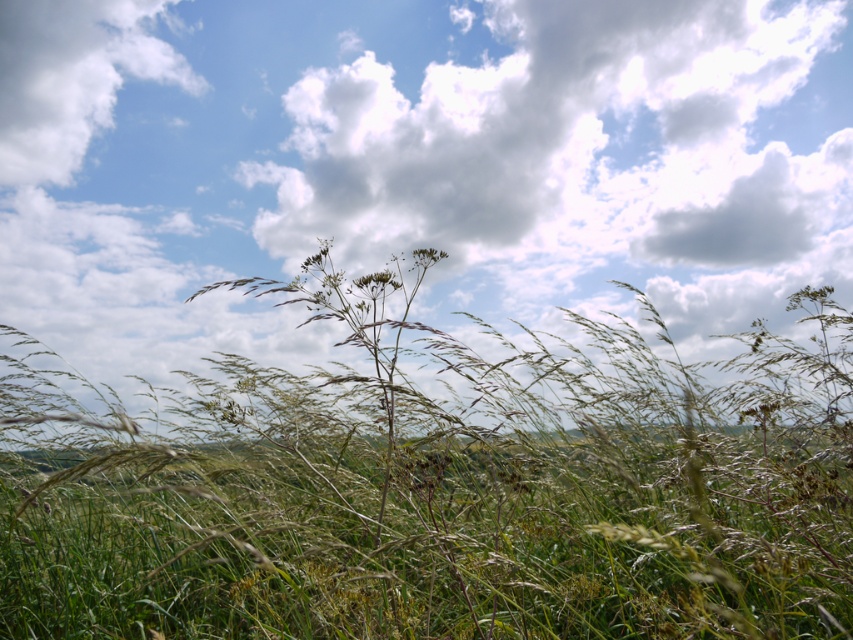
You are standing in the field of tall grasses and looking towards the sky. Which object is closer to you, the green grass at center or the white fluffy cloud at upper left?

The green grass at center is closer to you because it is positioned in front of the white fluffy cloud at upper left.

You are a photographer trying to capture the green grass at center and the white fluffy cloud at upper left in the same frame. Considering their sizes, which object would appear more prominent in the photo?

The green grass at center would appear more prominent in the photo because it has a larger size compared to the white fluffy cloud at upper left.